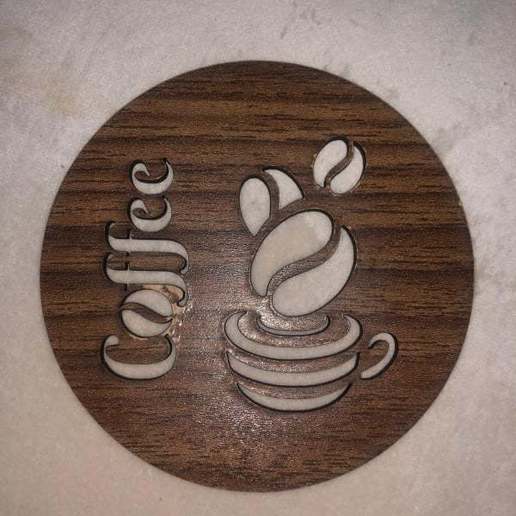
Find the location of a particular element. This screenshot has width=516, height=516. damaged wood is located at coordinates (174, 291).